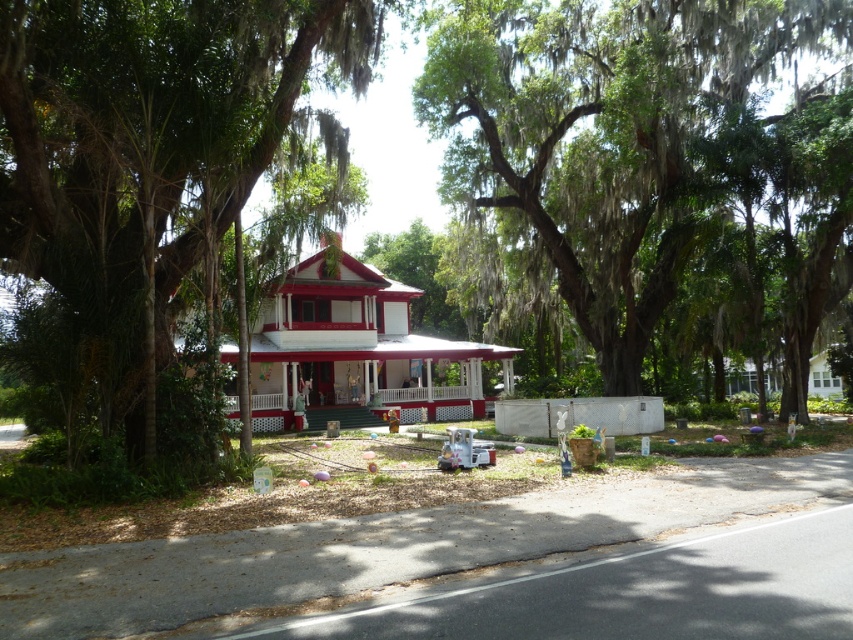
You are a painter hired to paint the house. You need to decide which area requires more materials between the green mossy tree at center and the white painted wood porch at center. Which one has a larger width?

The green mossy tree at center has a larger width than the white painted wood porch at center, so the green mossy tree at center requires more materials.

You are standing on the front lawn of the house and want to walk to the white painted wood porch at center. Which direction should you head to avoid the green leafy tree at center?

The green leafy tree at center is positioned on the left side of the white painted wood porch at center. To avoid it, you should head to the right side of the white painted wood porch at center.